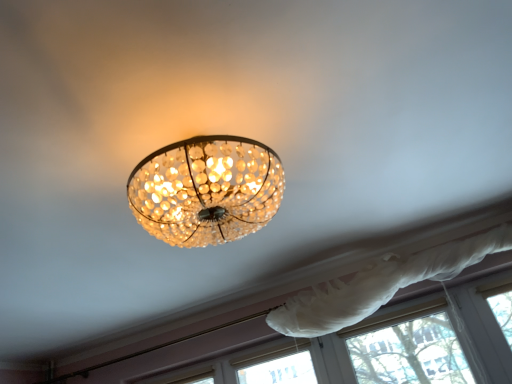
Question: In terms of width, does white sheer curtain at lower right look wider or thinner when compared to white sheer curtain at upper center?

Choices:
 (A) thin
 (B) wide

Answer: (A)

Question: From the image's perspective, is white sheer curtain at lower right above or below white sheer curtain at upper center?

Choices:
 (A) above
 (B) below

Answer: (B)

Question: Considering the positions of white sheer curtain at lower right and white sheer curtain at upper center in the image, is white sheer curtain at lower right taller or shorter than white sheer curtain at upper center?

Choices:
 (A) tall
 (B) short

Answer: (B)

Question: From the image's perspective, is white sheer curtain at upper center positioned above or below white sheer curtain at lower right?

Choices:
 (A) below
 (B) above

Answer: (B)

Question: Considering their positions, is white sheer curtain at upper center located in front of or behind white sheer curtain at lower right?

Choices:
 (A) behind
 (B) front

Answer: (B)

Question: In terms of height, does white sheer curtain at upper center look taller or shorter compared to white sheer curtain at lower right?

Choices:
 (A) short
 (B) tall

Answer: (B)

Question: Is white sheer curtain at upper center inside the boundaries of white sheer curtain at lower right, or outside?

Choices:
 (A) outside
 (B) inside

Answer: (A)